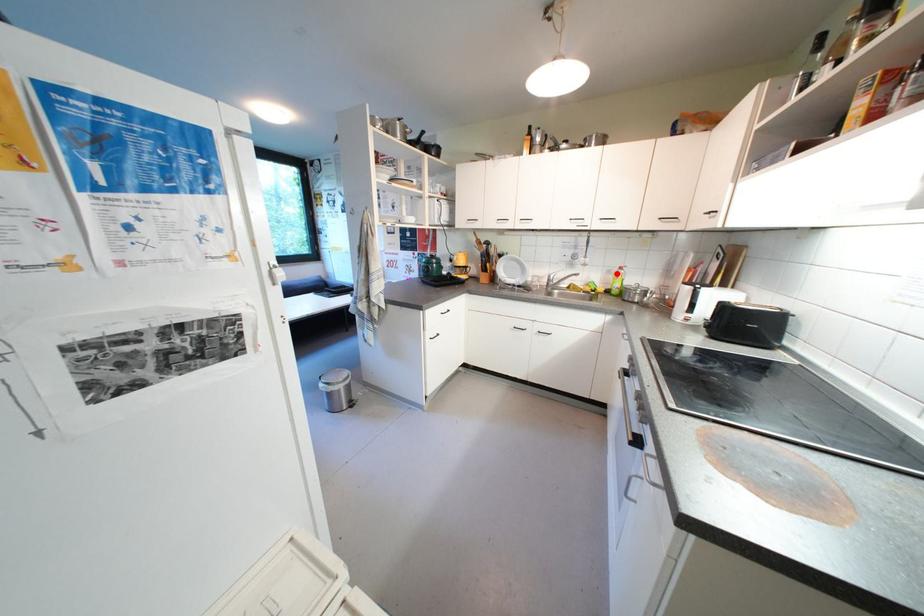
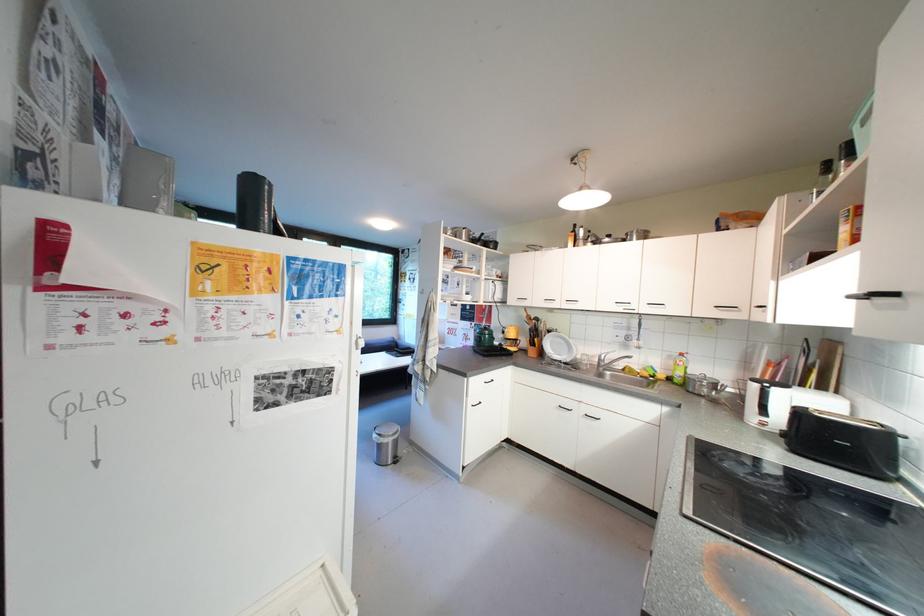
Where in the second image is the point corresponding to the highlighted location from the first image?

(677, 359)